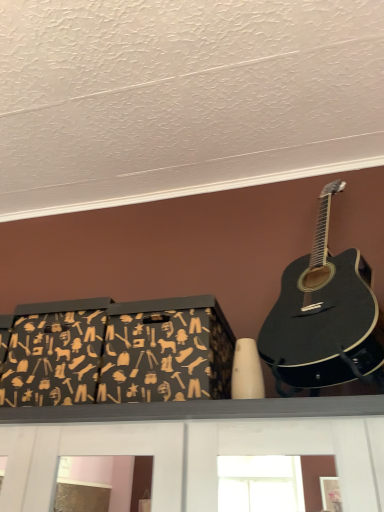
You are a GUI agent. You are given a task and a screenshot of the screen. Output one action in this format:
    pyautogui.click(x=<x>, y=<y>)
    Task: Click on the black matte acoustic guitar at upper right
    Image resolution: width=384 pixels, height=512 pixels.
    Given the screenshot: What is the action you would take?
    pyautogui.click(x=325, y=316)

Describe the element at coordinates (325, 316) in the screenshot. I see `black matte acoustic guitar at upper right` at that location.

In order to face black matte acoustic guitar at upper right, should I rotate leftwards or rightwards?

You should rotate right by 14.948 degrees.

Find the location of a particular element. Image resolution: width=384 pixels, height=512 pixels. black matte acoustic guitar at upper right is located at coordinates (325, 316).